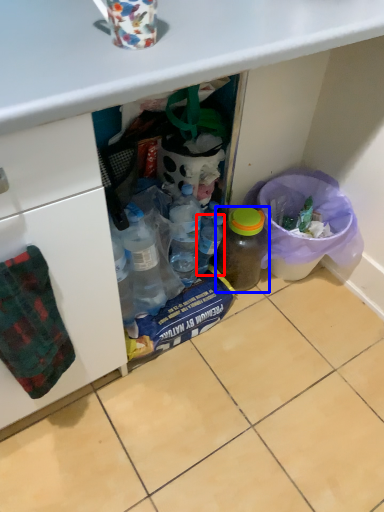
Question: Which point is further to the camera, bottle (highlighted by a red box) or bottle (highlighted by a blue box)?

Choices:
 (A) bottle
 (B) bottle

Answer: (A)